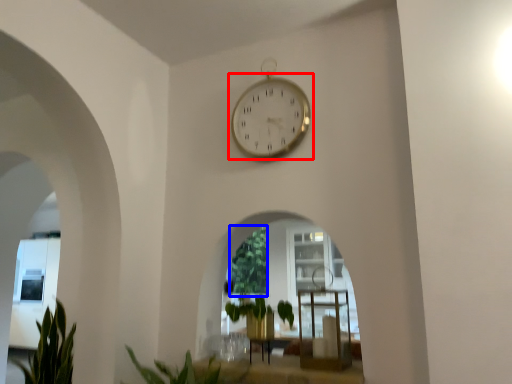
Question: Which of the following is the farthest to the observer, wall clock (highlighted by a red box) or vegetation (highlighted by a blue box)?

Choices:
 (A) wall clock
 (B) vegetation

Answer: (B)